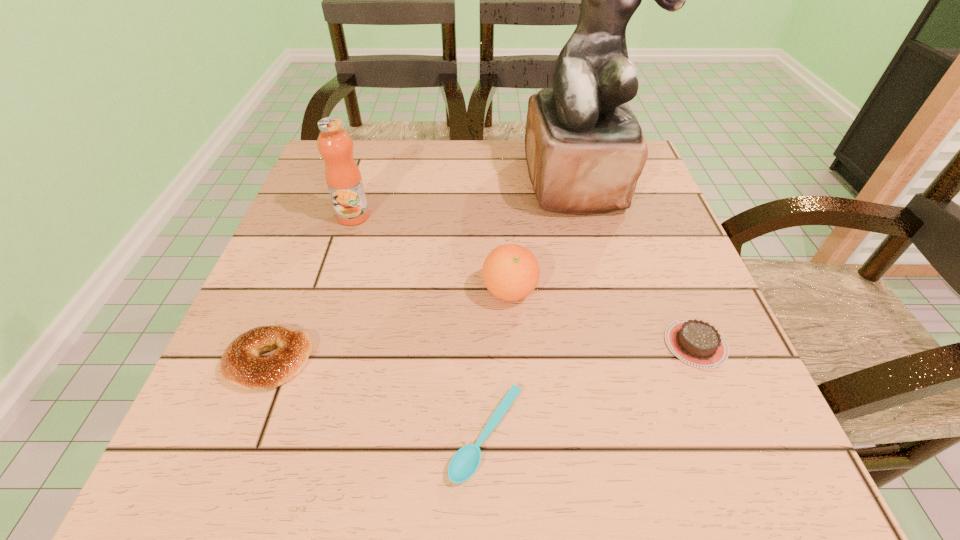
The width and height of the screenshot is (960, 540). What are the coordinates of `vacant space located on the right of the bagel` in the screenshot? It's located at (530, 362).

Locate an element on the screen. This screenshot has width=960, height=540. vacant space located 0.320m on the left of the chocolate cake is located at coordinates (471, 343).

Find the location of `free space located 0.280m on the left of the spoon`. free space located 0.280m on the left of the spoon is located at coordinates (252, 434).

The width and height of the screenshot is (960, 540). I want to click on object that is at the far edge, so click(585, 150).

Identify the location of object situated at the near edge. The width and height of the screenshot is (960, 540). (463, 465).

Image resolution: width=960 pixels, height=540 pixels. Identify the location of fruit juice situated at the left edge. (343, 177).

The width and height of the screenshot is (960, 540). I want to click on bagel situated at the left edge, so click(x=241, y=365).

Find the location of a particular element. The height and width of the screenshot is (540, 960). sculpture present at the right edge is located at coordinates (585, 150).

Image resolution: width=960 pixels, height=540 pixels. I want to click on chocolate cake that is at the right edge, so click(697, 343).

Locate an element on the screen. object present at the far right corner is located at coordinates (585, 150).